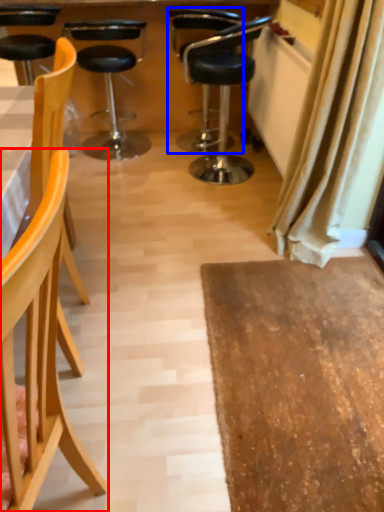
Question: Which object appears farthest to the camera in this image, chair (highlighted by a red box) or chair (highlighted by a blue box)?

Choices:
 (A) chair
 (B) chair

Answer: (B)